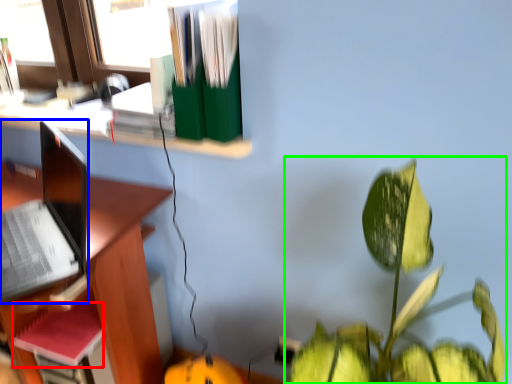
Question: Which is farther away from paperback book (highlighted by a red box)? laptop (highlighted by a blue box) or houseplant (highlighted by a green box)?

Choices:
 (A) laptop
 (B) houseplant

Answer: (B)